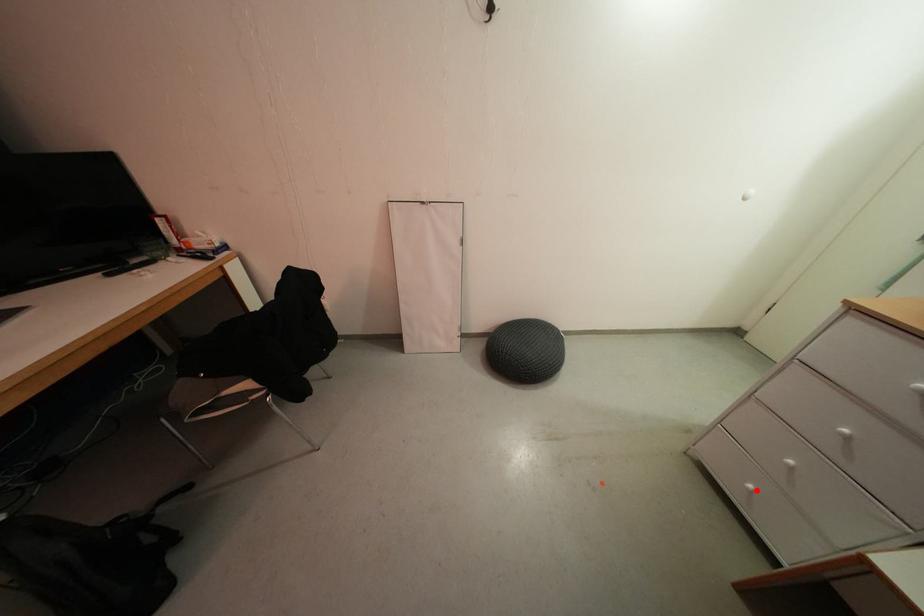
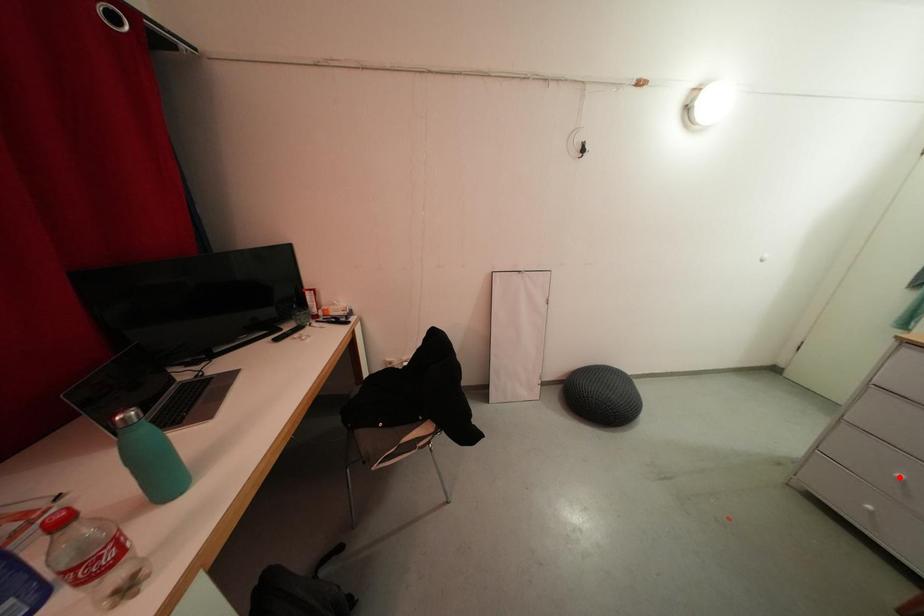
I am providing you with two images of the same scene from different viewpoints. A red point is marked on the first image and another point is marked on the second image. Do the highlighted points in image1 and image2 indicate the same real-world spot?

No